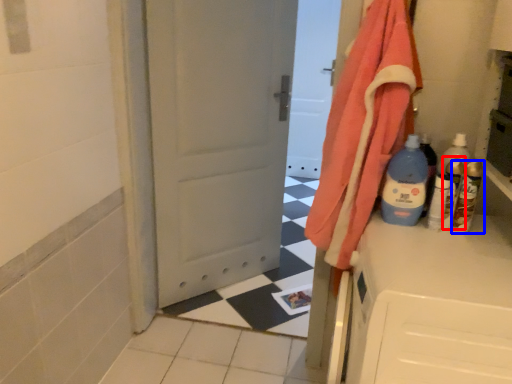
Question: Among these objects, which one is nearest to the camera, bottle (highlighted by a red box) or bottle (highlighted by a blue box)?

Choices:
 (A) bottle
 (B) bottle

Answer: (B)